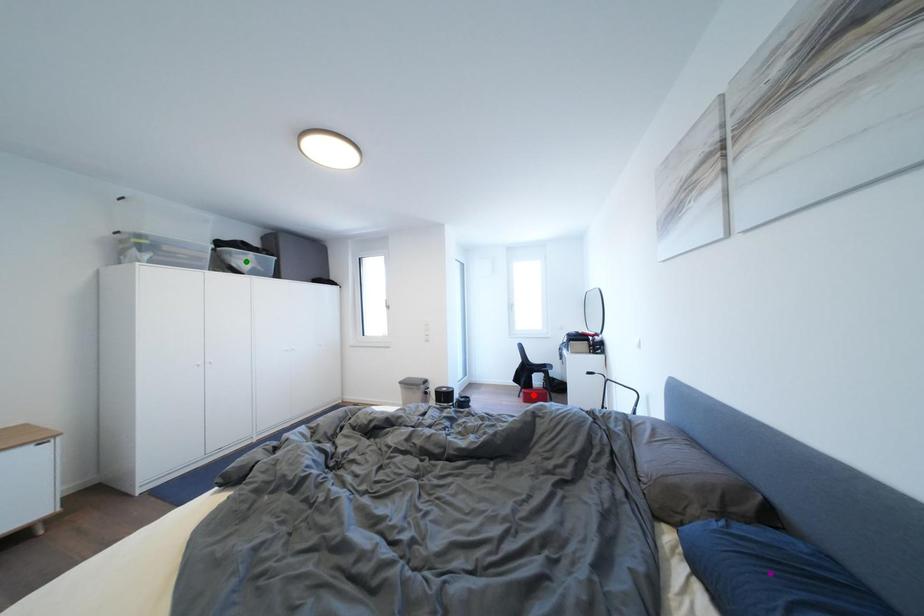
Order these from nearest to farthest:
A) red point
B) purple point
C) green point

purple point < green point < red point